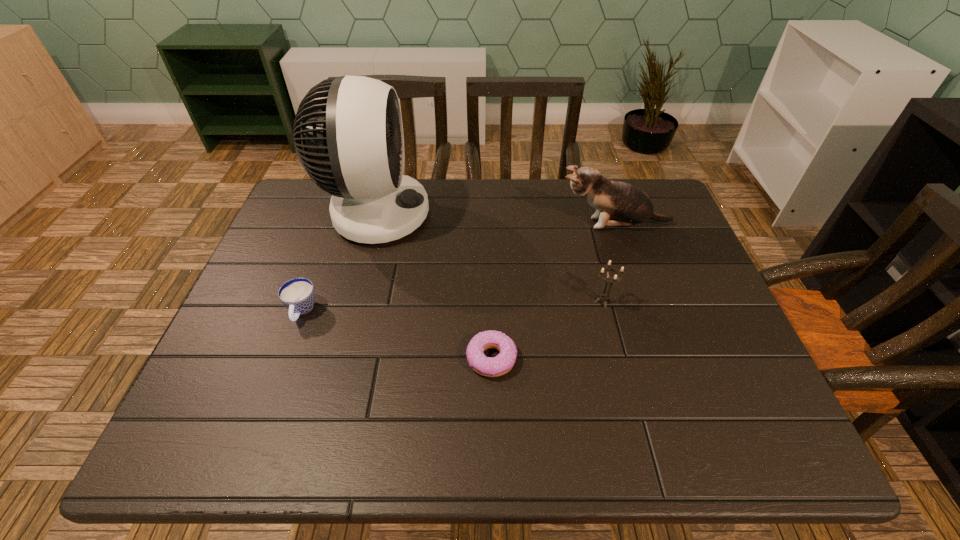
At what (x,y) coordinates should I click in order to perform the action: click on free location that satisfies the following two spatial constraints: 1. on the side of the second shortest object with the handle; 2. on the left side of the third object from left to right. Please return your answer as a coordinate pair (x, y). Looking at the image, I should click on (284, 359).

The height and width of the screenshot is (540, 960). I want to click on vacant position in the image that satisfies the following two spatial constraints: 1. on the grille of the fan; 2. on the back side of the third tallest object, so click(x=353, y=301).